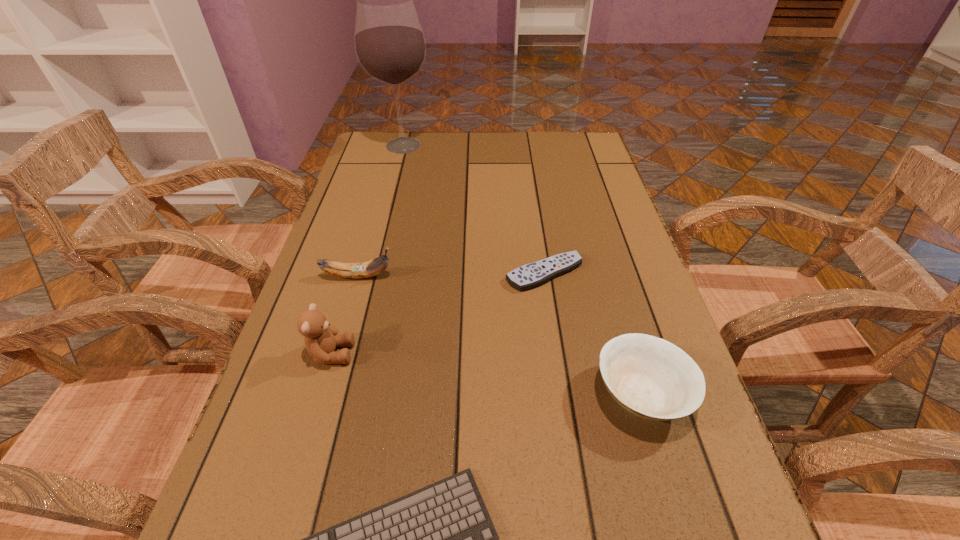
This screenshot has height=540, width=960. In order to click on vacant space positioned on the front of the fifth tallest object in this screenshot , I will do `click(569, 439)`.

Identify the location of object that is positioned at the far edge. This screenshot has height=540, width=960. (390, 46).

I want to click on alcohol located in the left edge section of the desktop, so click(x=390, y=46).

Locate an element on the screen. The height and width of the screenshot is (540, 960). teddy bear present at the left edge is located at coordinates (321, 339).

At what (x,y) coordinates should I click in order to perform the action: click on banana present at the left edge. Please return your answer as a coordinate pair (x, y). This screenshot has width=960, height=540. Looking at the image, I should click on (373, 267).

I want to click on bowl located at the right edge, so click(650, 377).

Identify the location of remote control located at the right edge. (528, 276).

Locate an element on the screen. object positioned at the far left corner is located at coordinates (390, 46).

Find the location of a particular element. The width and height of the screenshot is (960, 540). vacant space at the far edge is located at coordinates (427, 137).

Locate an element on the screen. Image resolution: width=960 pixels, height=540 pixels. blank space at the left edge of the desktop is located at coordinates (388, 176).